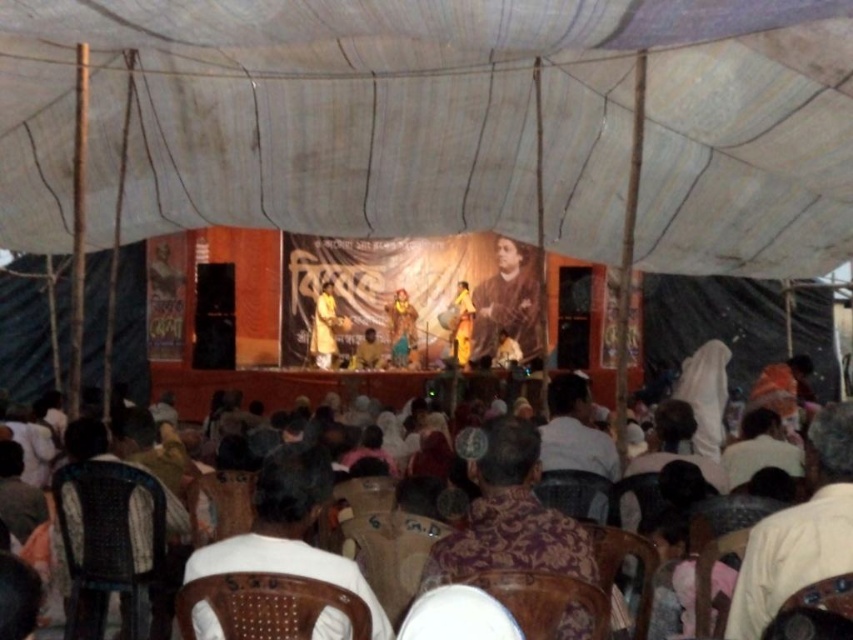
Can you confirm if brown textured fabric at center is shorter than brown fabric cloth at center?

No, brown textured fabric at center is not shorter than brown fabric cloth at center.

Which is in front, point (531, 333) or point (373, 346)?

Point (373, 346) is in front.

The image size is (853, 640). Find the location of `brown textured fabric at center`. brown textured fabric at center is located at coordinates (508, 300).

This screenshot has height=640, width=853. What do you see at coordinates (326, 326) in the screenshot?
I see `golden fabric sari at center` at bounding box center [326, 326].

Does golden fabric sari at center come in front of golden fabric dress at center?

No, golden fabric sari at center is behind golden fabric dress at center.

Is point (323, 360) behind point (402, 362)?

Yes, it is.

Identify the location of golden fabric sari at center. (326, 326).

Measure the distance between point (537,344) and camera.

Point (537,344) is 98.68 meters away from camera.

Who is taller, brown textured fabric at center or white fabric chairs at center?

Answer: With more height is brown textured fabric at center.

Who is more distant from viewer, (509, 310) or (691, 429)?

Positioned behind is point (509, 310).

Identify the location of brown textured fabric at center. (508, 300).